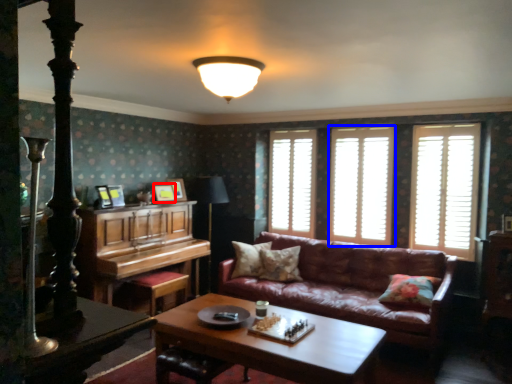
Question: Which point is closer to the camera, picture frame (highlighted by a red box) or window (highlighted by a blue box)?

Choices:
 (A) picture frame
 (B) window

Answer: (B)